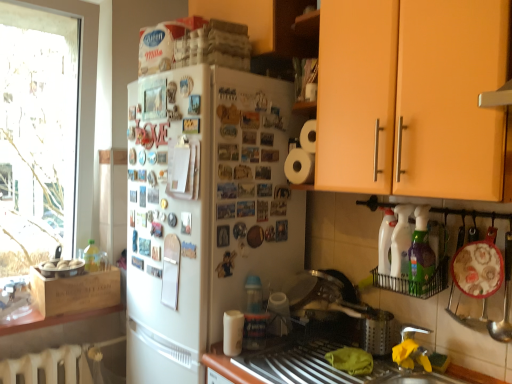
In order to face transparent glass window at left, should I rotate leftwards or rightwards?

It's best to rotate left around 25.069 degrees.

The height and width of the screenshot is (384, 512). I want to click on white matte refrigerator at center, so click(x=203, y=210).

What do you see at coordinates (411, 349) in the screenshot?
I see `silver metallic faucet at lower right` at bounding box center [411, 349].

Where is `transparent glass window at left`? transparent glass window at left is located at coordinates (37, 135).

From a real-world perspective, is orange matte cabinet at upper right on white matte paper towel at lower center?

Yes.

Does orange matte cabinet at upper right appear on the right side of white matte paper towel at lower center?

Yes.

Is orange matte cabinet at upper right not near white matte paper towel at lower center?

No, orange matte cabinet at upper right is not far from white matte paper towel at lower center.

Looking at this image, can white matte refrigerator at center be found inside transparent glass window at left?

No, transparent glass window at left does not contain white matte refrigerator at center.

Is transparent glass window at left far away from white matte refrigerator at center?

Yes, transparent glass window at left is far from white matte refrigerator at center.

Based on the photo, from the image's perspective, is transparent glass window at left on white matte refrigerator at center?

Yes, from the image's perspective, transparent glass window at left is on top of white matte refrigerator at center.

Between transparent glass window at left and white matte refrigerator at center, which one has smaller size?

transparent glass window at left is smaller.

Which is less distant, (30, 26) or (411, 241)?

The point (411, 241) is closer.

Can you confirm if transparent glass window at left is smaller than white glossy bottle at right, which is counted as the 2th bottle, starting from the front?

Actually, transparent glass window at left might be larger than white glossy bottle at right, which is counted as the 2th bottle, starting from the front.

Is transparent glass window at left turned away from white glossy bottle at right, arranged as the 1th bottle when viewed from the back?

No, transparent glass window at left is not facing the opposite direction of white glossy bottle at right, arranged as the 1th bottle when viewed from the back.

In terms of width, does metallic silver sink at lower center look wider or thinner when compared to silver metallic faucet at lower right?

metallic silver sink at lower center is wider than silver metallic faucet at lower right.

Does metallic silver sink at lower center have a lesser height compared to silver metallic faucet at lower right?

Incorrect, the height of metallic silver sink at lower center does not fall short of that of silver metallic faucet at lower right.

You are a GUI agent. You are given a task and a screenshot of the screen. Output one action in this format:
    pyautogui.click(x=<x>, y=<y>)
    Task: Click on the faucet above the metallic silver sink at lower center (from a real-world perspective)
    Image resolution: width=512 pixels, height=384 pixels.
    Given the screenshot: What is the action you would take?
    pyautogui.click(x=411, y=349)

Is white matte paper towel at lower center aimed at silver metallic sink at lower right?

No, white matte paper towel at lower center does not turn towards silver metallic sink at lower right.

This screenshot has width=512, height=384. What are the coordinates of `sink located in front of the white matte paper towel at lower center` in the screenshot? It's located at (414, 360).

From the image's perspective, which one is positioned higher, white matte paper towel at lower center or silver metallic sink at lower right?

white matte paper towel at lower center is shown above in the image.

Can you tell me how much white matte refrigerator at center and white matte paper towel at lower center differ in facing direction?

0.703 degrees.

Is white matte refrigerator at center facing away from white matte paper towel at lower center?

No.

Between white matte refrigerator at center and white matte paper towel at lower center, which one has smaller size?

Smaller between the two is white matte paper towel at lower center.

From a real-world perspective, which is physically above, white matte refrigerator at center or white matte paper towel at lower center?

white matte refrigerator at center, from a real-world perspective.

In terms of size, does white matte refrigerator at center appear bigger or smaller than silver metallic faucet at lower right?

Considering their sizes, white matte refrigerator at center takes up more space than silver metallic faucet at lower right.

Which is more to the right, white matte refrigerator at center or silver metallic faucet at lower right?

silver metallic faucet at lower right.

Is white matte refrigerator at center oriented away from silver metallic faucet at lower right?

white matte refrigerator at center does not have its back to silver metallic faucet at lower right.

Is white matte refrigerator at center in contact with silver metallic faucet at lower right?

white matte refrigerator at center and silver metallic faucet at lower right are clearly separated.

In order to click on cabinetry that is in front of the white matte paper towel at lower center in this screenshot , I will do `click(399, 85)`.

Identify the location of refrigerator that appears on the right of transparent glass window at left. The image size is (512, 384). (203, 210).

Estimate the real-world distances between objects in this image. Which object is further from transparent glass window at left, white matte refrigerator at center or green plastic bottle at lower right, the 2th bottle viewed from the back?

green plastic bottle at lower right, the 2th bottle viewed from the back, is positioned further to the anchor transparent glass window at left.

Which object lies nearer to the anchor point silver metallic sink at lower right, silver metallic faucet at lower right or orange matte cabinet at upper right?

Based on the image, silver metallic faucet at lower right appears to be nearer to silver metallic sink at lower right.

From the picture: Which object lies nearer to the anchor point green plastic bottle at lower right, the 2th bottle viewed from the back, white matte paper towel at lower center or orange matte cabinet at upper right?

orange matte cabinet at upper right lies closer to green plastic bottle at lower right, the 2th bottle viewed from the back, than the other object.

Which object lies nearer to the anchor point silver metallic faucet at lower right, white matte refrigerator at center or metallic silver sink at lower center?

metallic silver sink at lower center is closer to silver metallic faucet at lower right.

Which object lies further to the anchor point white matte refrigerator at center, orange matte cabinet at upper right or white glossy bottle at right, arranged as the 1th bottle when viewed from the back?

The object further to white matte refrigerator at center is white glossy bottle at right, arranged as the 1th bottle when viewed from the back.

Which object lies nearer to the anchor point white matte paper towel at lower center, transparent glass window at left or silver metallic faucet at lower right?

The object closer to white matte paper towel at lower center is silver metallic faucet at lower right.

From the image, which object appears to be nearer to green plastic bottle at lower right, the 2th bottle viewed from the back, silver metallic faucet at lower right or orange matte cabinet at upper right?

Based on the image, silver metallic faucet at lower right appears to be nearer to green plastic bottle at lower right, the 2th bottle viewed from the back.

Which object lies further to the anchor point white glossy bottle at right, arranged as the 1th bottle when viewed from the back, silver metallic sink at lower right or white matte paper towel at lower center?

white matte paper towel at lower center is positioned further to the anchor white glossy bottle at right, arranged as the 1th bottle when viewed from the back.

Identify the location of refrigerator located between transparent glass window at left and orange matte cabinet at upper right in the left-right direction. The height and width of the screenshot is (384, 512). (203, 210).

The width and height of the screenshot is (512, 384). In order to click on refrigerator situated between transparent glass window at left and silver metallic sink at lower right from left to right in this screenshot , I will do `click(203, 210)`.

Locate an element on the screen. This screenshot has height=384, width=512. faucet between orange matte cabinet at upper right and metallic silver sink at lower center from top to bottom is located at coordinates (411, 349).

This screenshot has width=512, height=384. I want to click on cabinetry between transparent glass window at left and green plastic bottle at lower right, the first bottle in the front-to-back sequence, so click(x=399, y=85).